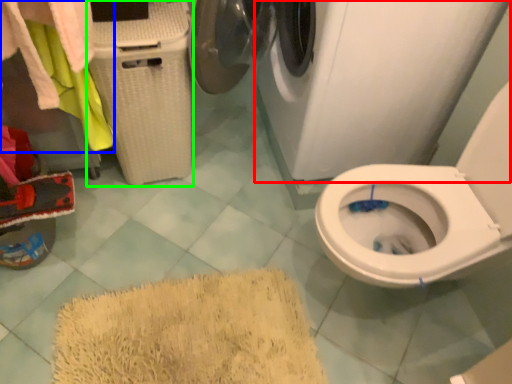
Question: Which object is positioned farthest from washing machine (highlighted by a red box)? Select from laundry (highlighted by a blue box) and laundry basket (highlighted by a green box).

Choices:
 (A) laundry
 (B) laundry basket

Answer: (A)